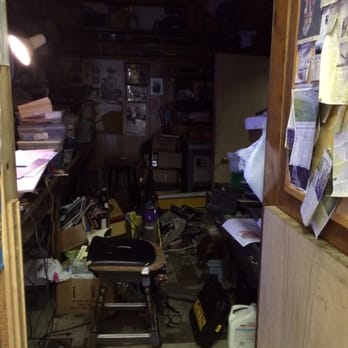
Find the location of `doorway`. doorway is located at coordinates (269, 177), (0, 167).